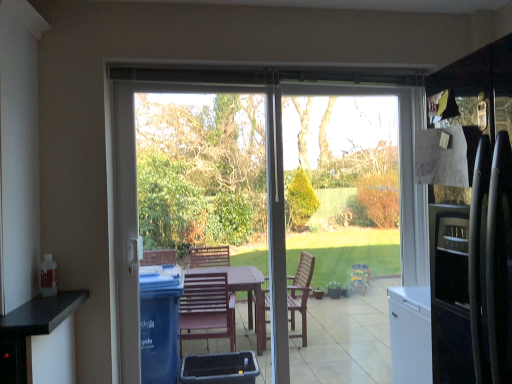
Locate an element on the screen. This screenshot has width=512, height=384. transparent glass door at center is located at coordinates (292, 92).

Does transparent glass window screen at center have a greater width compared to transparent glass door at center?

Incorrect, the width of transparent glass window screen at center does not surpass that of transparent glass door at center.

Considering the points (315, 281) and (267, 68), which point is behind, point (315, 281) or point (267, 68)?

The point (315, 281) is farther.

From a real-world perspective, is transparent glass window screen at center physically above transparent glass door at center?

Yes, from a real-world perspective, transparent glass window screen at center is over transparent glass door at center

What's the angular difference between transparent glass door at center and transparent plastic screen door at center's facing directions?

transparent glass door at center and transparent plastic screen door at center are facing 1.08 degrees away from each other.

Is transparent glass door at center to the right of transparent plastic screen door at center from the viewer's perspective?

Yes, transparent glass door at center is to the right of transparent plastic screen door at center.

Considering the sizes of objects transparent glass door at center and transparent plastic screen door at center in the image provided, who is taller, transparent glass door at center or transparent plastic screen door at center?

transparent glass door at center.

Choose the correct answer: Is transparent glass door at center inside transparent plastic screen door at center or outside it?

transparent glass door at center is not inside transparent plastic screen door at center, it's outside.

Which of these two, transparent plastic screen door at center or transparent glass door at center, stands shorter?

With less height is transparent plastic screen door at center.

Is transparent plastic screen door at center closer to camera compared to transparent glass door at center?

Yes, transparent plastic screen door at center is closer to the viewer.

Is transparent plastic screen door at center not within transparent glass door at center?

That's incorrect, transparent plastic screen door at center is not completely outside transparent glass door at center.

From the picture: Which object is positioned more to the left, transparent plastic screen door at center or transparent glass door at center?

transparent plastic screen door at center is more to the left.

From the picture: From the image's perspective, which object appears higher, transparent plastic screen door at center or transparent glass window screen at center?

transparent plastic screen door at center, from the image's perspective.

Is transparent plastic screen door at center at the right side of transparent glass window screen at center?

No, transparent plastic screen door at center is not to the right of transparent glass window screen at center.

Based on the photo, from a real-world perspective, is transparent plastic screen door at center positioned under transparent glass window screen at center based on gravity?

No.

Is the surface of transparent glass window screen at center in direct contact with transparent plastic screen door at center?

There is a gap between transparent glass window screen at center and transparent plastic screen door at center.

From the image's perspective, is transparent glass window screen at center above or below transparent plastic screen door at center?

Based on their image positions, transparent glass window screen at center is located beneath transparent plastic screen door at center.

From a real-world perspective, is transparent glass window screen at center positioned over transparent plastic screen door at center based on gravity?

Actually, transparent glass window screen at center is physically below transparent plastic screen door at center in the real world.

Is transparent glass window screen at center further to camera compared to transparent plastic screen door at center?

Yes, transparent glass window screen at center is further from the camera.

Which of these two, transparent glass door at center or transparent glass window screen at center, is bigger?

Bigger between the two is transparent glass door at center.

Is transparent glass door at center positioned before transparent glass window screen at center?

Yes.

Is transparent glass door at center located outside transparent glass window screen at center?

Actually, transparent glass door at center is within transparent glass window screen at center.

Identify the location of door lying on the left of transparent glass window screen at center. Image resolution: width=512 pixels, height=384 pixels. (292, 92).

Identify the location of door below the transparent plastic screen door at center (from the image's perspective). This screenshot has width=512, height=384. (292, 92).

Which object lies further to the anchor point transparent glass window screen at center, transparent glass door at center or transparent plastic screen door at center?

transparent plastic screen door at center lies further to transparent glass window screen at center than the other object.

From the image, which object appears to be nearer to transparent plastic screen door at center, transparent glass window screen at center or transparent glass door at center?

transparent glass door at center is closer to transparent plastic screen door at center.

Looking at the image, which one is located closer to transparent glass door at center, transparent glass window screen at center or transparent plastic screen door at center?

transparent glass window screen at center is positioned closer to the anchor transparent glass door at center.

Based on their spatial positions, is transparent plastic screen door at center or transparent glass door at center closer to transparent glass window screen at center?

transparent glass door at center.

Estimate the real-world distances between objects in this image. Which object is further from transparent plastic screen door at center, transparent glass door at center or transparent glass window screen at center?

Among the two, transparent glass window screen at center is located further to transparent plastic screen door at center.

Based on their spatial positions, is transparent plastic screen door at center or transparent glass window screen at center further from transparent glass door at center?

Based on the image, transparent plastic screen door at center appears to be further to transparent glass door at center.

Locate an element on the screen. This screenshot has width=512, height=384. door between transparent plastic screen door at center and transparent glass window screen at center from left to right is located at coordinates (292, 92).